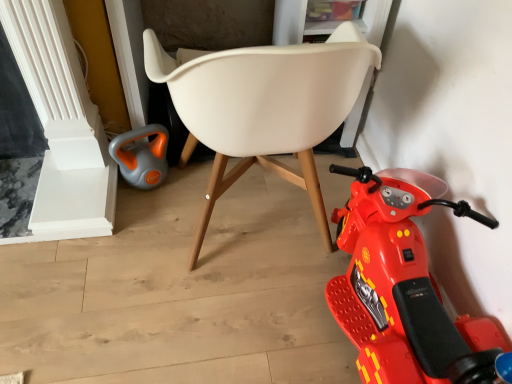
The width and height of the screenshot is (512, 384). I want to click on vacant space positioned to the left of shiny plastic scooter at lower right, so click(245, 331).